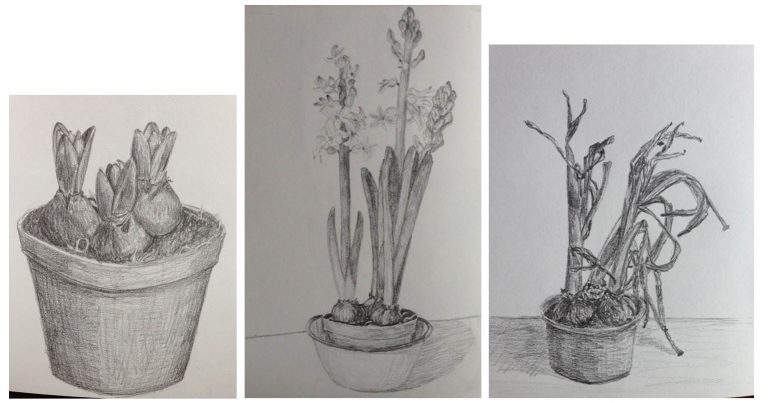
You are a GUI agent. You are given a task and a screenshot of the screen. Output one action in this format:
    pyautogui.click(x=<x>, y=<y>)
    Task: Click on the tabletop
    
    Given the screenshot: What is the action you would take?
    pyautogui.click(x=288, y=358), pyautogui.click(x=736, y=347)